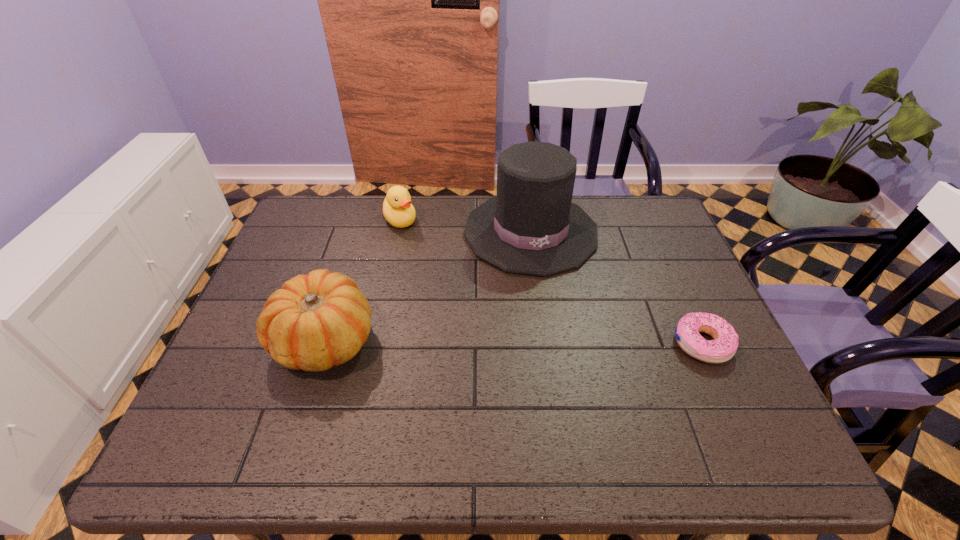
Identify the location of gourd. The image size is (960, 540). (314, 322).

You are a GUI agent. You are given a task and a screenshot of the screen. Output one action in this format:
    pyautogui.click(x=<x>, y=<y>)
    Task: Click on the shortest object
    
    Given the screenshot: What is the action you would take?
    pyautogui.click(x=723, y=347)

The width and height of the screenshot is (960, 540). I want to click on doughnut, so click(723, 347).

I want to click on the tallest object, so click(x=531, y=227).

At what (x,y) coordinates should I click in order to perform the action: click on the third object from left to right. Please return your answer as a coordinate pair (x, y). Looking at the image, I should click on (531, 227).

Identify the location of the third tallest object. This screenshot has width=960, height=540. (397, 208).

The width and height of the screenshot is (960, 540). Find the location of `vacant area situated on the right of the gourd`. vacant area situated on the right of the gourd is located at coordinates (448, 340).

The width and height of the screenshot is (960, 540). Find the location of `free location located on the back of the rightmost object`. free location located on the back of the rightmost object is located at coordinates (648, 224).

The image size is (960, 540). I want to click on vacant area situated 0.110m on the front of the second object from right to left with the decoration, so click(553, 308).

The image size is (960, 540). Find the location of `free location located on the front of the second object from right to left with the decoration`. free location located on the front of the second object from right to left with the decoration is located at coordinates (550, 296).